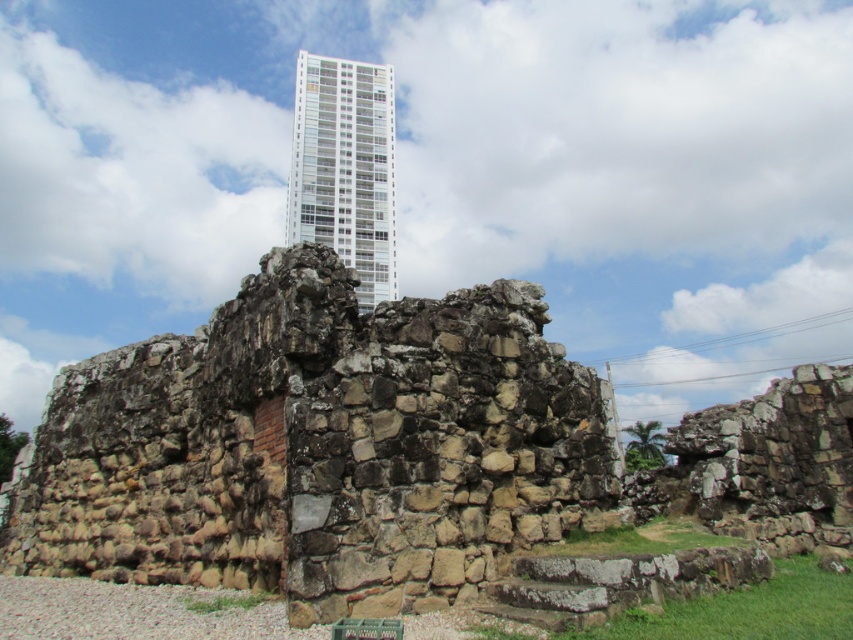
You are standing at the point closest to the old stone structure. Which point, point (329,525) or point (361,154), is closer to you?

Point (329,525) is closer to you because it is in front of point (361,154).

You are an architect analyzing the spatial relationship between the brown stone ruins at center and the white glassy building at upper center. Which structure is located higher in the image?

The white glassy building at upper center is higher in the image than the brown stone ruins at center.